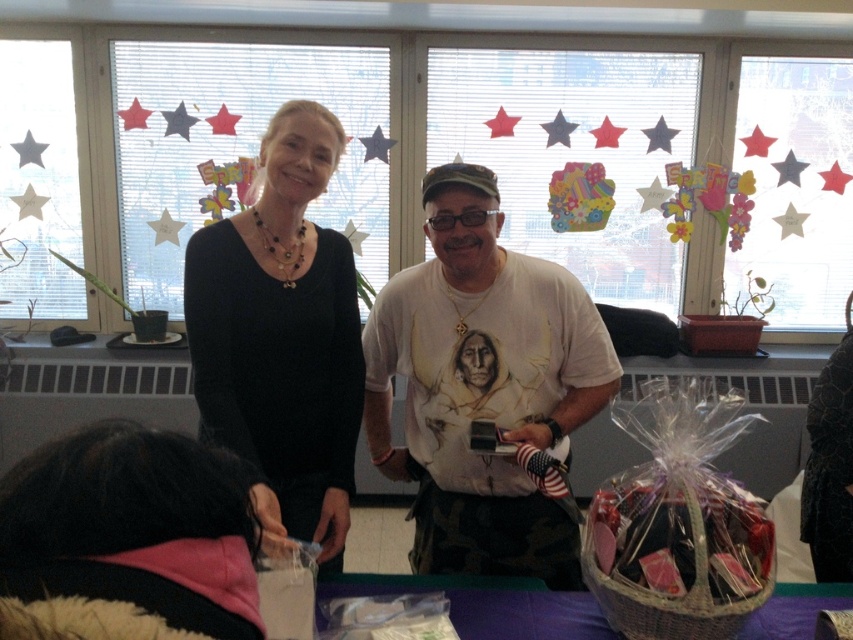
You are a photographer setting up a shot in this scene. You want to ensure that both the black matte sweater at upper center and the purple fabric table at lower center are in focus. Given that your camera can focus on objects within a 50 cm range, will both items be in focus?

The distance between the black matte sweater at upper center and the purple fabric table at lower center is 45.46 centimeters, which is within the camera focus range of 50 cm. Therefore, both items will be in focus.

You are organizing a charity event and need to decide which item to donate first. The black matte sweater at upper center and the matte wicker basket at lower right are both available. Which item takes up more space?

The black matte sweater at upper center is bigger than the matte wicker basket at lower right, so it takes up more space.

You are a photographer setting up for a portrait. You notice the black matte sweater at upper center and the pink fleece scarf at lower left in the scene. Which item is covering the other?

The black matte sweater at upper center is positioned over the pink fleece scarf at lower left, so it is covering the scarf.